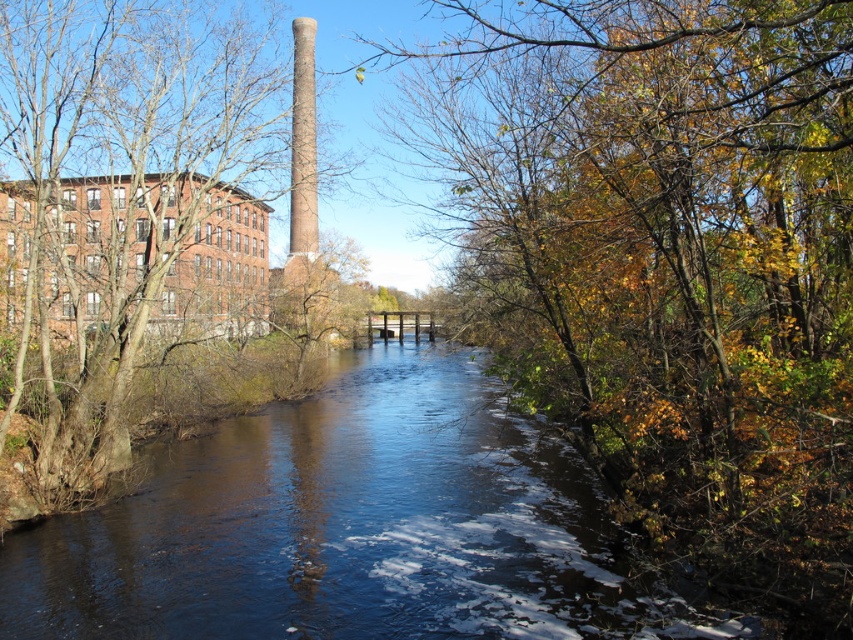
Who is lower down, autumn leaves at center or smooth bark tree at left?

autumn leaves at center

Does autumn leaves at center lie in front of smooth bark tree at left?

Yes, autumn leaves at center is in front of smooth bark tree at left.

Where is `autumn leaves at center`? The image size is (853, 640). autumn leaves at center is located at coordinates (668, 266).